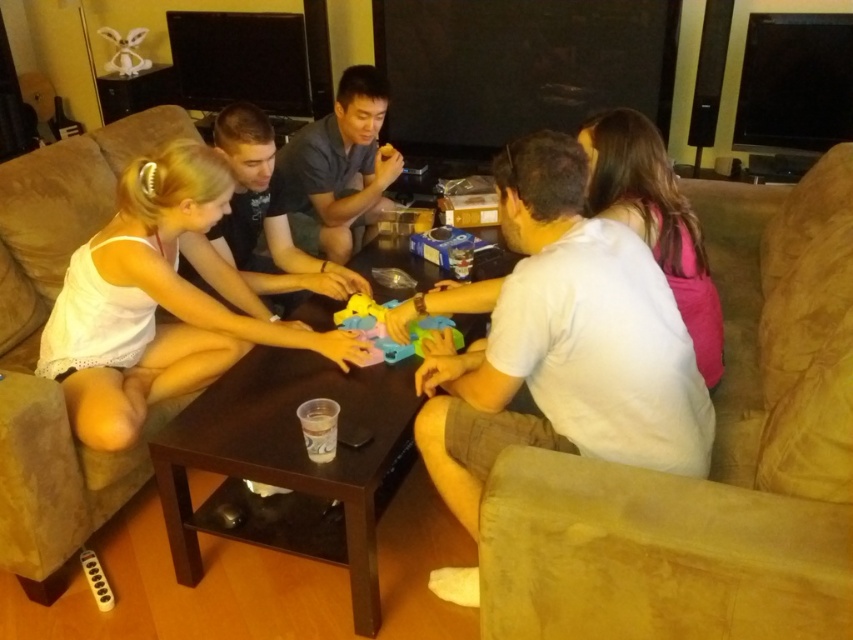
You are a guest at a family gathering and want to place your drink on the rubberized plastic toy at center. Considering the height of the suede couch at lower right, will the drink be stable?

The suede couch at lower right is taller than the rubberized plastic toy at center, so placing the drink on the rubberized plastic toy at center might not be stable due to its lower height compared to the couch.

You are a person who is 1.7 meters tall. You are standing in the living room and want to place a tall decoration on the highest point between the suede couch at lower right and the brown wooden table at center. Which object should you choose to place it on?

The suede couch at lower right is taller than the brown wooden table at center, so you should place the tall decoration on the suede couch at lower right.